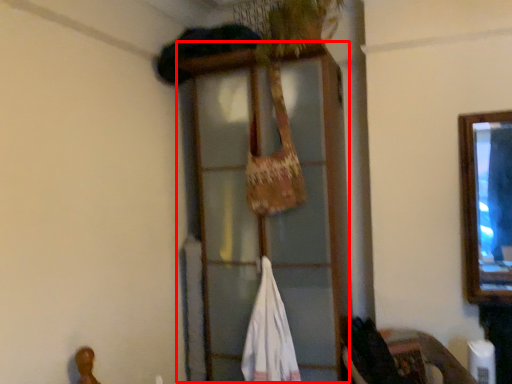
Question: From the image's perspective, what is the correct spatial relationship of window frame (annotated by the red box) in relation to wide?

Choices:
 (A) below
 (B) above

Answer: (B)